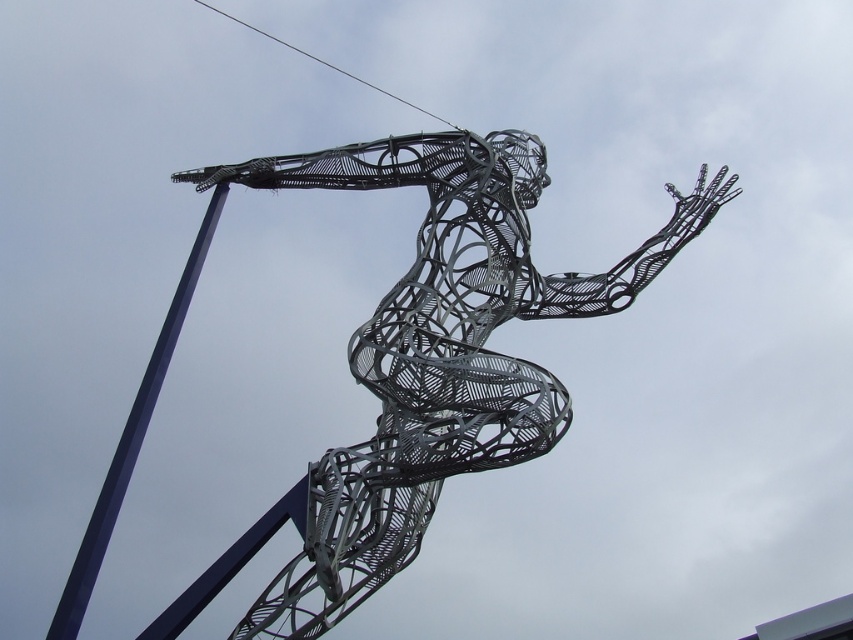
Question: Does metallic wire sculpture at center appear on the left side of blue metallic pole at left?

Choices:
 (A) yes
 (B) no

Answer: (B)

Question: Based on their relative distances, which object is nearer to the blue metallic pole at left?

Choices:
 (A) metallic wire at upper center
 (B) metallic wire sculpture at center

Answer: (B)

Question: Which point appears closest to the camera in this image?

Choices:
 (A) (440, 118)
 (B) (103, 488)

Answer: (B)

Question: Which object is positioned farthest from the metallic wire at upper center?

Choices:
 (A) blue metallic pole at left
 (B) metallic wire sculpture at center

Answer: (A)

Question: Observing the image, what is the correct spatial positioning of metallic wire sculpture at center in reference to blue metallic pole at left?

Choices:
 (A) left
 (B) right

Answer: (B)

Question: Is blue metallic pole at left to the right of metallic wire at upper center from the viewer's perspective?

Choices:
 (A) no
 (B) yes

Answer: (A)